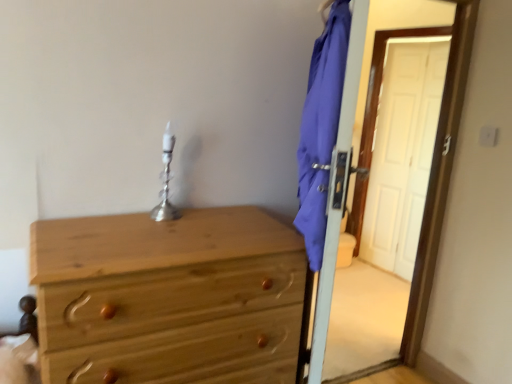
I want to click on vacant point to the left of silver metallic table lamp at center, so click(x=110, y=217).